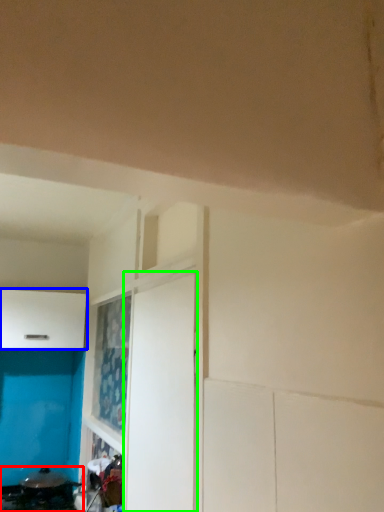
Question: Which is nearer to the appliance (highlighted by a red box)? cabinetry (highlighted by a blue box) or door (highlighted by a green box).

Choices:
 (A) cabinetry
 (B) door

Answer: (A)